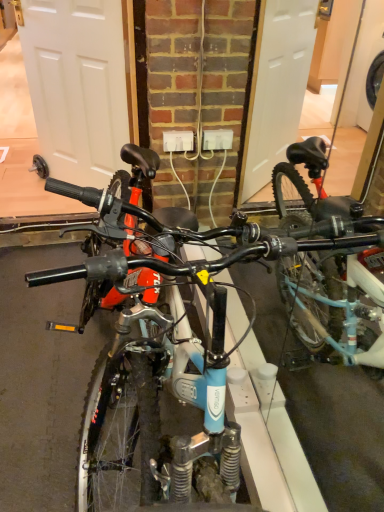
Question: Does blue matte bicycle at center have a greater width compared to white plastic power outlet at center?

Choices:
 (A) no
 (B) yes

Answer: (B)

Question: Is blue matte bicycle at center behind white plastic power outlet at center?

Choices:
 (A) no
 (B) yes

Answer: (A)

Question: Would you say blue matte bicycle at center contains white plastic power outlet at center?

Choices:
 (A) no
 (B) yes

Answer: (A)

Question: Is blue matte bicycle at center at the left side of white plastic power outlet at center?

Choices:
 (A) yes
 (B) no

Answer: (B)

Question: Does blue matte bicycle at center appear on the right side of white plastic power outlet at center?

Choices:
 (A) no
 (B) yes

Answer: (B)

Question: Considering the positions of point (89, 155) and point (183, 145), is point (89, 155) closer or farther from the camera than point (183, 145)?

Choices:
 (A) farther
 (B) closer

Answer: (A)

Question: Relative to white plastic power outlet at center, is white matte door at left in front or behind?

Choices:
 (A) front
 (B) behind

Answer: (A)

Question: From the image's perspective, relative to white plastic power outlet at center, is white matte door at left above or below?

Choices:
 (A) below
 (B) above

Answer: (B)

Question: Which is correct: white matte door at left is inside white plastic power outlet at center, or outside of it?

Choices:
 (A) outside
 (B) inside

Answer: (A)

Question: Is white matte door at left wider or thinner than blue matte bicycle at center?

Choices:
 (A) wide
 (B) thin

Answer: (B)

Question: Based on their positions, is white matte door at left located to the left or right of blue matte bicycle at center?

Choices:
 (A) left
 (B) right

Answer: (A)

Question: Is white matte door at left bigger or smaller than blue matte bicycle at center?

Choices:
 (A) big
 (B) small

Answer: (B)

Question: Is white matte door at left inside or outside of blue matte bicycle at center?

Choices:
 (A) inside
 (B) outside

Answer: (B)

Question: From a real-world perspective, is white plastic power outlet at center physically located above or below blue matte bicycle at center?

Choices:
 (A) below
 (B) above

Answer: (B)

Question: Considering their positions, is white plastic power outlet at center located in front of or behind blue matte bicycle at center?

Choices:
 (A) behind
 (B) front

Answer: (A)